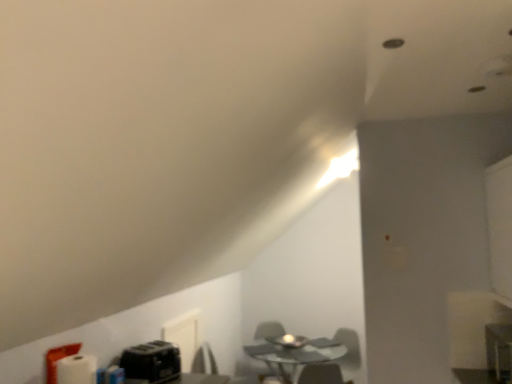
Measure the distance between metallic silver computer desk at lower right and camera.

metallic silver computer desk at lower right is 7.46 feet away from camera.

This screenshot has width=512, height=384. In order to click on metallic silver computer desk at lower right in this screenshot , I will do `click(499, 351)`.

Find the location of a particular element. matte gray swivel chair at center is located at coordinates (269, 330).

In the scene shown: Considering the relative sizes of transparent glass table at center and matte gray swivel chair at center in the image provided, is transparent glass table at center bigger than matte gray swivel chair at center?

Correct, transparent glass table at center is larger in size than matte gray swivel chair at center.

From a real-world perspective, is transparent glass table at center located higher than matte gray swivel chair at center?

Yes, from a real-world perspective, transparent glass table at center is above matte gray swivel chair at center.

Considering the relative positions of transparent glass table at center and matte gray swivel chair at center in the image provided, is transparent glass table at center behind matte gray swivel chair at center?

No.

From a real-world perspective, is metallic silver computer desk at lower right above or below matte gray swivel chair at center?

metallic silver computer desk at lower right is situated higher than matte gray swivel chair at center in the real world.

Considering the relative sizes of metallic silver computer desk at lower right and matte gray swivel chair at center in the image provided, is metallic silver computer desk at lower right shorter than matte gray swivel chair at center?

Correct, metallic silver computer desk at lower right is not as tall as matte gray swivel chair at center.

Where is `swivel chair below the metallic silver computer desk at lower right (from the image's perspective)`? swivel chair below the metallic silver computer desk at lower right (from the image's perspective) is located at coordinates (269, 330).

From the picture: Can you confirm if metallic silver computer desk at lower right is positioned to the left of matte gray swivel chair at center?

No, metallic silver computer desk at lower right is not to the left of matte gray swivel chair at center.

From the image's perspective, is metallic silver computer desk at lower right positioned above or below transparent glass table at center?

metallic silver computer desk at lower right is situated higher than transparent glass table at center in the image.

Is metallic silver computer desk at lower right at the left side of transparent glass table at center?

In fact, metallic silver computer desk at lower right is to the right of transparent glass table at center.

Which object is closer to the camera taking this photo, metallic silver computer desk at lower right or transparent glass table at center?

A: metallic silver computer desk at lower right is in front.

From a real-world perspective, is metallic silver computer desk at lower right positioned above or below transparent glass table at center?

Clearly, from a real-world perspective, metallic silver computer desk at lower right is above transparent glass table at center.

Where is `swivel chair lying behind the metallic silver computer desk at lower right`? swivel chair lying behind the metallic silver computer desk at lower right is located at coordinates click(269, 330).

Considering the relative sizes of matte gray swivel chair at center and metallic silver computer desk at lower right in the image provided, is matte gray swivel chair at center wider than metallic silver computer desk at lower right?

Yes, matte gray swivel chair at center is wider than metallic silver computer desk at lower right.

In the image, is matte gray swivel chair at center positioned in front of or behind metallic silver computer desk at lower right?

Visually, matte gray swivel chair at center is located behind metallic silver computer desk at lower right.

Is metallic silver computer desk at lower right at the back of matte gray swivel chair at center?

That's not correct — matte gray swivel chair at center is not looking away from metallic silver computer desk at lower right.

Who is smaller, transparent glass table at center or metallic silver computer desk at lower right?

Smaller between the two is metallic silver computer desk at lower right.

Is transparent glass table at center taller than metallic silver computer desk at lower right?

Yes.

Is transparent glass table at center outside of metallic silver computer desk at lower right?

transparent glass table at center lies outside metallic silver computer desk at lower right's area.

Can you confirm if transparent glass table at center is positioned to the left of metallic silver computer desk at lower right?

Yes.

From the picture: From the image's perspective, between black plastic toaster at lower left and transparent glass table at center, which one is located above?

black plastic toaster at lower left.

Is black plastic toaster at lower left to the left of transparent glass table at center from the viewer's perspective?

Yes, black plastic toaster at lower left is to the left of transparent glass table at center.

In the scene shown: Looking at their sizes, would you say black plastic toaster at lower left is wider or thinner than transparent glass table at center?

Considering their sizes, black plastic toaster at lower left looks slimmer than transparent glass table at center.

Consider the image. Does black plastic toaster at lower left turn towards transparent glass table at center?

No, black plastic toaster at lower left is not facing towards transparent glass table at center.

From the image's perspective, is matte gray swivel chair at center on top of black plastic toaster at lower left?

Incorrect, from the image's perspective, matte gray swivel chair at center is lower than black plastic toaster at lower left.

Image resolution: width=512 pixels, height=384 pixels. I want to click on swivel chair that is under the black plastic toaster at lower left (from a real-world perspective), so click(269, 330).

From a real-world perspective, which object rests below the other?

matte gray swivel chair at center is physically lower.

Is matte gray swivel chair at center taller than black plastic toaster at lower left?

Yes, matte gray swivel chair at center is taller than black plastic toaster at lower left.

Where is `swivel chair below the transparent glass table at center (from the image's perspective)`? Image resolution: width=512 pixels, height=384 pixels. swivel chair below the transparent glass table at center (from the image's perspective) is located at coordinates (269, 330).

Identify the location of computer desk that appears above the matte gray swivel chair at center (from the image's perspective). (499, 351).

When comparing their distances from metallic silver computer desk at lower right, does transparent glass table at center or matte gray swivel chair at center seem closer?

Based on the image, transparent glass table at center appears to be nearer to metallic silver computer desk at lower right.

Which object lies nearer to the anchor point matte gray swivel chair at center, metallic silver computer desk at lower right or black plastic toaster at lower left?

black plastic toaster at lower left lies closer to matte gray swivel chair at center than the other object.

Based on their spatial positions, is matte gray swivel chair at center or transparent glass table at center further from metallic silver computer desk at lower right?

Based on the image, matte gray swivel chair at center appears to be further to metallic silver computer desk at lower right.

Which object lies further to the anchor point transparent glass table at center, matte gray swivel chair at center or metallic silver computer desk at lower right?

Among the two, metallic silver computer desk at lower right is located further to transparent glass table at center.

Based on their spatial positions, is matte gray swivel chair at center or transparent glass table at center further from black plastic toaster at lower left?

matte gray swivel chair at center is positioned further to the anchor black plastic toaster at lower left.

From the image, which object appears to be nearer to black plastic toaster at lower left, metallic silver computer desk at lower right or transparent glass table at center?

transparent glass table at center lies closer to black plastic toaster at lower left than the other object.

Considering their positions, is matte gray swivel chair at center positioned closer to transparent glass table at center than black plastic toaster at lower left?

matte gray swivel chair at center is closer to transparent glass table at center.

Estimate the real-world distances between objects in this image. Which object is closer to matte gray swivel chair at center, transparent glass table at center or metallic silver computer desk at lower right?

transparent glass table at center lies closer to matte gray swivel chair at center than the other object.

You are a GUI agent. You are given a task and a screenshot of the screen. Output one action in this format:
    pyautogui.click(x=<x>, y=<y>)
    Task: Click on the table between black plastic toaster at lower left and metallic silver computer desk at lower right from left to right
    
    Given the screenshot: What is the action you would take?
    pyautogui.click(x=293, y=353)

Where is `appliance located between metallic silver computer desk at lower right and matte gray swivel chair at center in the depth direction`? The height and width of the screenshot is (384, 512). appliance located between metallic silver computer desk at lower right and matte gray swivel chair at center in the depth direction is located at coordinates (151, 362).

Identify the location of table between metallic silver computer desk at lower right and matte gray swivel chair at center in the front-back direction. (293, 353).

What are the coordinates of `table between black plastic toaster at lower left and matte gray swivel chair at center in the front-back direction` in the screenshot? It's located at (293, 353).